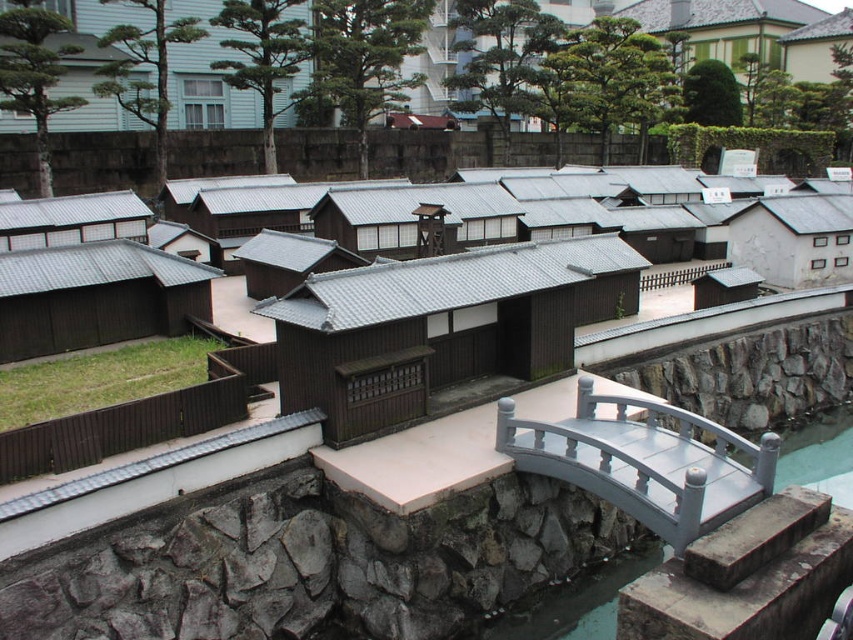
You are a tourist visiting this traditional Japanese site and want to take a photo of both the white matte building at right and the matte gray roof at left. Which object should you position closer to the camera to ensure both are fully visible in the frame?

You should position the white matte building at right closer to the camera because it is shorter than the matte gray roof at left, allowing both to fit within the frame without one being cut off.

Consider the image. You are a tourist standing on the stone bridge in the foreground of the scene. You notice a brown wood hut at lower left and a matte gray roof at left. Which structure is closer to the ground?

The brown wood hut at lower left is shorter than the matte gray roof at left, so it is closer to the ground.

You are standing at the center of the stone bridge in the foreground. Looking towards the white matte building at right, what is the direction of the building relative to your position?

The white matte building at right is located to the right side of your position.